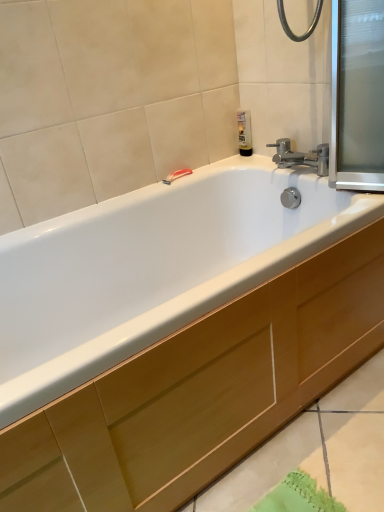
Question: From a real-world perspective, is wooden cabinet at lower center above or below translucent plastic soap dispenser at upper right?

Choices:
 (A) below
 (B) above

Answer: (A)

Question: From the image's perspective, relative to translucent plastic soap dispenser at upper right, is wooden cabinet at lower center above or below?

Choices:
 (A) above
 (B) below

Answer: (B)

Question: Which object is positioned farthest from the transparent glass screen door at upper right?

Choices:
 (A) translucent plastic soap dispenser at upper right
 (B) red plastic towel bar at upper center
 (C) wooden cabinet at lower center

Answer: (C)

Question: Estimate the real-world distances between objects in this image. Which object is farther from the wooden cabinet at lower center?

Choices:
 (A) red plastic towel bar at upper center
 (B) transparent glass screen door at upper right
 (C) translucent plastic soap dispenser at upper right

Answer: (C)